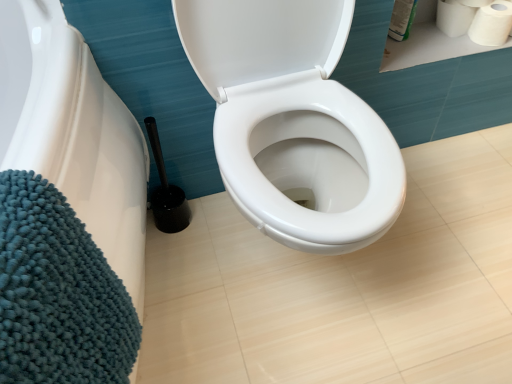
In order to click on vacant space to the right of black plastic toilet brush at lower left in this screenshot , I will do `click(219, 223)`.